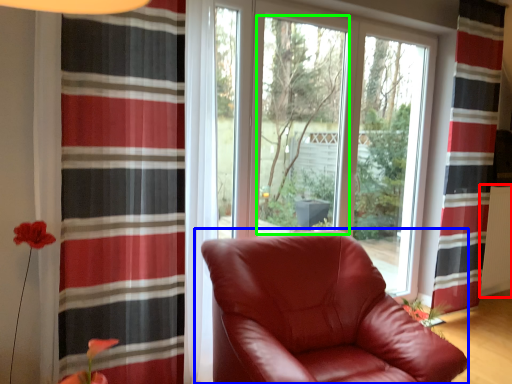
Question: Based on their relative distances, which object is farther from radiator (highlighted by a red box)? Choose from chair (highlighted by a blue box) and window screen (highlighted by a green box).

Choices:
 (A) chair
 (B) window screen

Answer: (A)